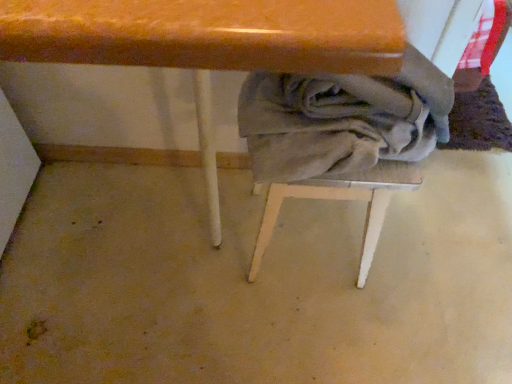
Question: From a real-world perspective, is gray cotton laundry at lower center above or below gray fabric-covered stool at center?

Choices:
 (A) above
 (B) below

Answer: (A)

Question: In terms of size, does gray cotton laundry at lower center appear bigger or smaller than gray fabric-covered stool at center?

Choices:
 (A) small
 (B) big

Answer: (A)

Question: Estimate the real-world distances between objects in this image. Which object is farther from the wooden table at center?

Choices:
 (A) gray fabric-covered stool at center
 (B) gray cotton laundry at lower center

Answer: (A)

Question: Which object is the farthest from the gray fabric-covered stool at center?

Choices:
 (A) wooden table at center
 (B) gray cotton laundry at lower center

Answer: (A)